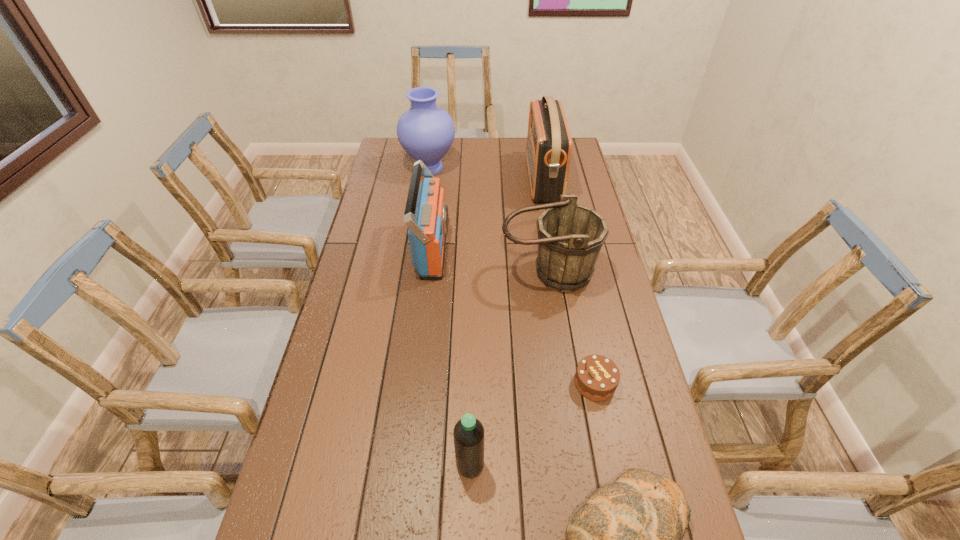
Find the location of `vacant area situated 0.200m on the front-facing side of the farther radio receiver`. vacant area situated 0.200m on the front-facing side of the farther radio receiver is located at coordinates (481, 180).

The height and width of the screenshot is (540, 960). I want to click on free spot located on the front-facing side of the farther radio receiver, so click(476, 180).

The image size is (960, 540). Identify the location of free spot located 0.290m on the front-facing side of the farther radio receiver. (460, 180).

This screenshot has height=540, width=960. Find the location of `blank space located 0.180m on the front-facing side of the nearer radio receiver`. blank space located 0.180m on the front-facing side of the nearer radio receiver is located at coordinates (498, 250).

The height and width of the screenshot is (540, 960). Find the location of `vacant area situated on the handle side of the bucket`. vacant area situated on the handle side of the bucket is located at coordinates (566, 401).

The image size is (960, 540). I want to click on vacant space located on the left of the water bottle, so click(359, 465).

You are a GUI agent. You are given a task and a screenshot of the screen. Output one action in this format:
    pyautogui.click(x=<x>, y=<y>)
    Task: Click on the vacant space located on the front of the third nearest object
    
    Given the screenshot: What is the action you would take?
    pyautogui.click(x=626, y=535)

Where is `vase that is at the far edge`? This screenshot has height=540, width=960. vase that is at the far edge is located at coordinates (426, 132).

Where is `radio receiver present at the far edge`? radio receiver present at the far edge is located at coordinates coord(548,150).

Find the location of `object present at the left edge`. object present at the left edge is located at coordinates (426, 132).